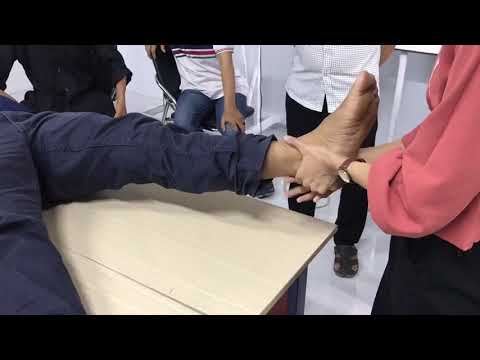
Locate an element on the screen. This screenshot has height=360, width=480. walls is located at coordinates (275, 70), (144, 87).